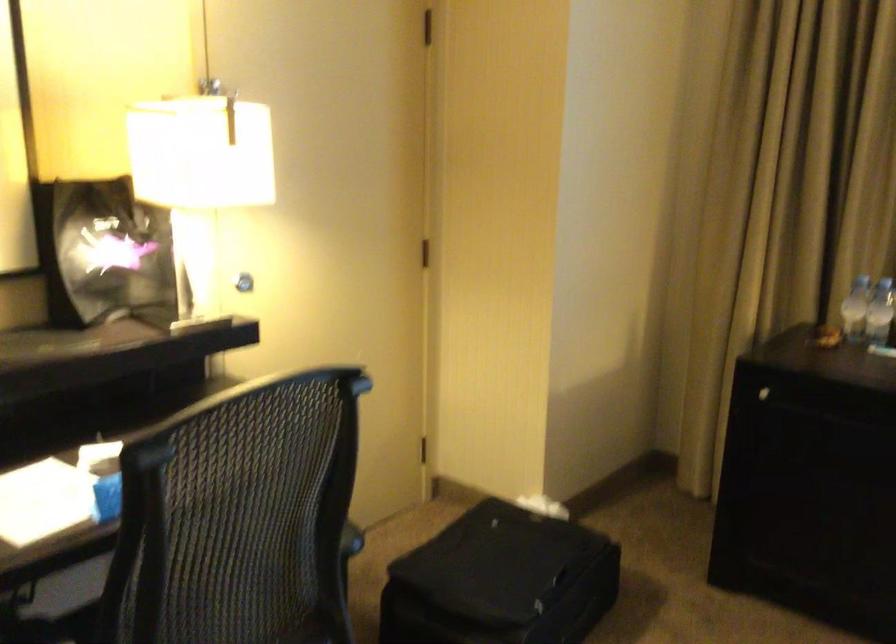
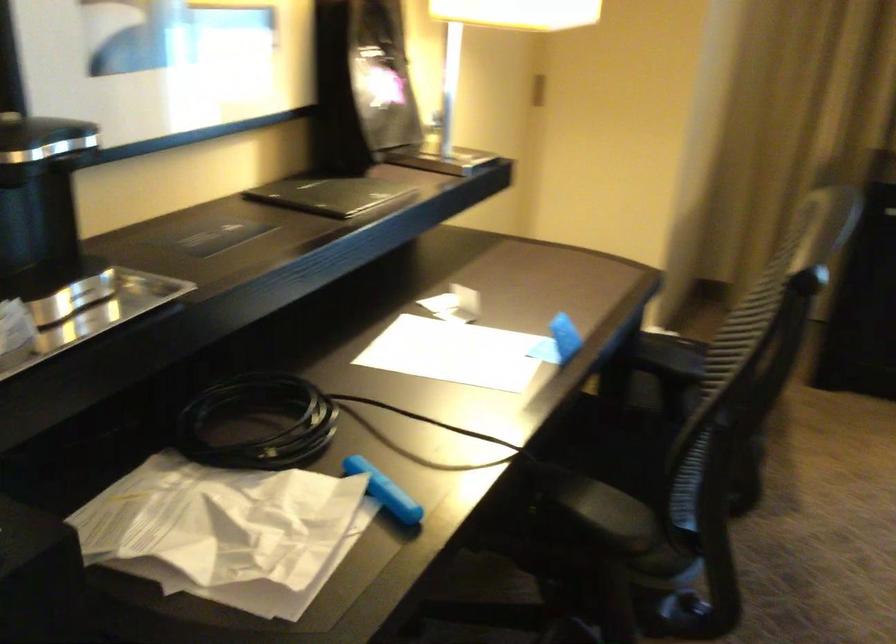
Question: In a continuous first-person perspective shot, in which direction is the camera moving?

Choices:
 (A) Left
 (B) Right
 (C) Forward
 (D) Backward

Answer: (A)